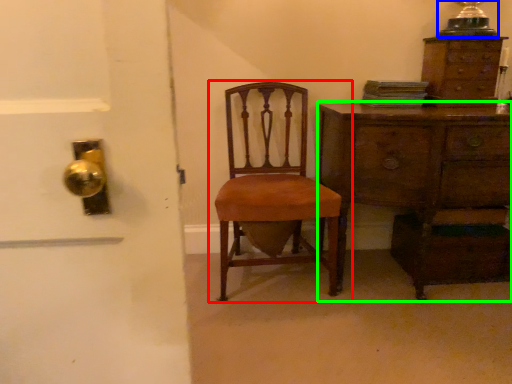
Question: Estimate the real-world distances between objects in this image. Which object is farther from chair (highlighted by a red box), table lamp (highlighted by a blue box) or chest of drawers (highlighted by a green box)?

Choices:
 (A) table lamp
 (B) chest of drawers

Answer: (A)